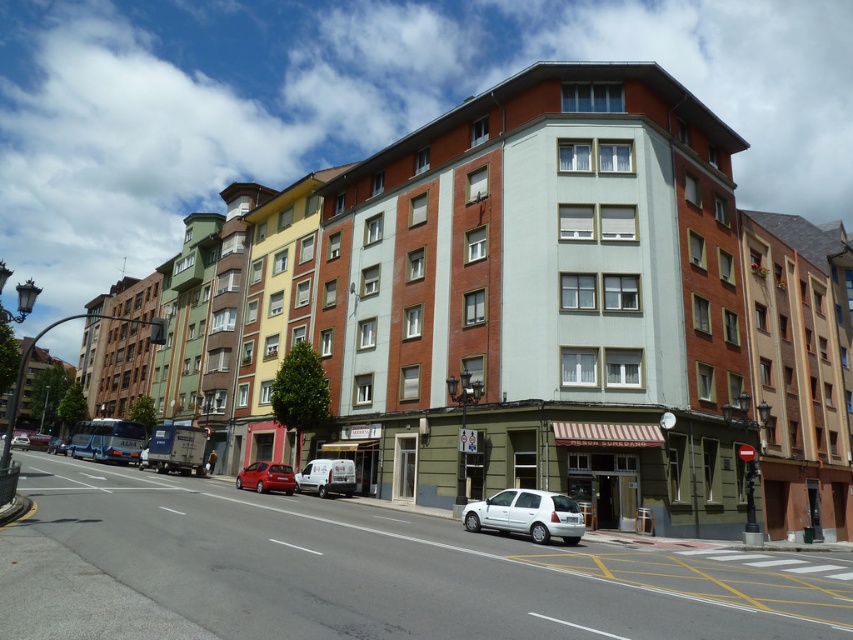
Can you confirm if white matte van at center is positioned below matte black car at center?

No.

Does point (337, 486) come closer to viewer compared to point (53, 442)?

Yes, point (337, 486) is in front of point (53, 442).

Where is `white matte van at center`? white matte van at center is located at coordinates (328, 476).

Who is positioned more to the right, shiny red hatchback at center or metallic silver van at center-left?

Positioned to the right is shiny red hatchback at center.

Does shiny red hatchback at center appear under metallic silver van at center-left?

No, shiny red hatchback at center is not below metallic silver van at center-left.

Does point (270, 472) come in front of point (138, 465)?

Yes.

Locate an element on the screen. The width and height of the screenshot is (853, 640). shiny red hatchback at center is located at coordinates (265, 477).

Is point (53, 440) positioned after point (148, 444)?

Yes, it is behind point (148, 444).

Between matte black car at center and metallic silver van at center-left, which one has less height?

metallic silver van at center-left

Is point (49, 444) closer to camera compared to point (148, 442)?

No, it is not.

Where is `matte black car at center`? matte black car at center is located at coordinates (56, 445).